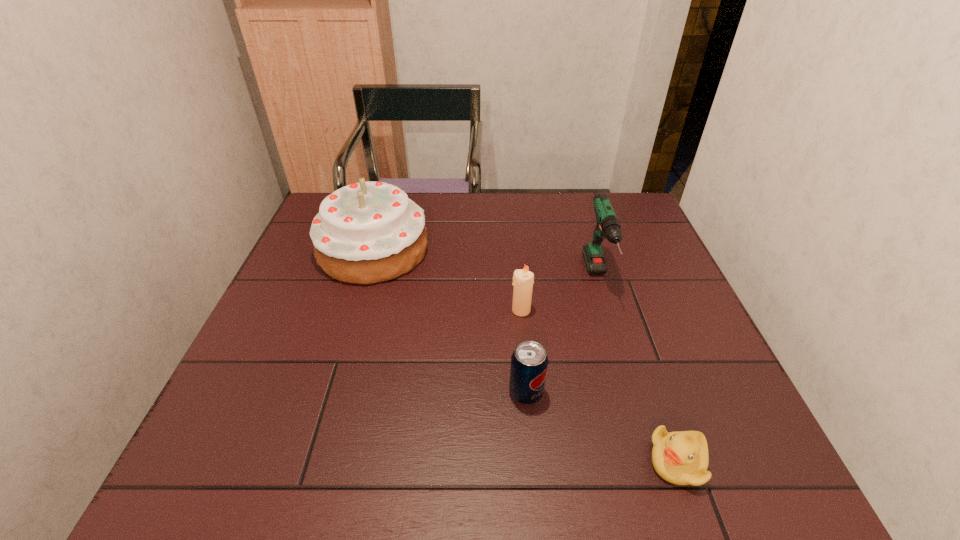
This screenshot has width=960, height=540. What are the coordinates of `free point at the far edge` in the screenshot? It's located at (580, 231).

Locate an element on the screen. This screenshot has width=960, height=540. vacant space at the near edge of the desktop is located at coordinates (328, 490).

In order to click on free space at the left edge of the desktop in this screenshot , I will do `click(291, 272)`.

Locate an element on the screen. This screenshot has width=960, height=540. vacant space at the right edge of the desktop is located at coordinates click(x=642, y=267).

Find the location of a particular element. The height and width of the screenshot is (540, 960). vacant space at the near left corner of the desktop is located at coordinates (272, 476).

The width and height of the screenshot is (960, 540). Identify the location of vacant space at the far right corner of the desktop. (609, 195).

Locate an element on the screen. The height and width of the screenshot is (540, 960). free space between the shortest object and the candle is located at coordinates (599, 386).

Image resolution: width=960 pixels, height=540 pixels. Find the location of `free spot between the candle and the shortest object`. free spot between the candle and the shortest object is located at coordinates (599, 386).

I want to click on vacant area that lies between the drill and the shortest object, so click(x=637, y=370).

This screenshot has width=960, height=540. I want to click on free space between the soda can and the shortest object, so click(602, 427).